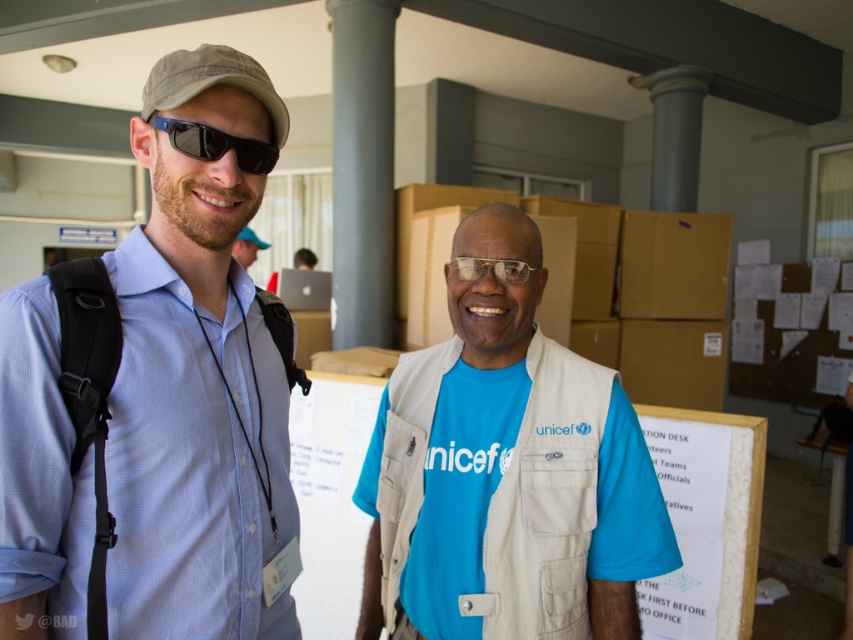
Which is more to the right, gray concrete pillar at center or matte black backpack at left?

From the viewer's perspective, gray concrete pillar at center appears more on the right side.

Describe the element at coordinates (363, 170) in the screenshot. I see `gray concrete pillar at center` at that location.

Between point (376, 227) and point (236, 248), which one is positioned behind?

Point (236, 248)

The height and width of the screenshot is (640, 853). I want to click on gray concrete pillar at center, so click(x=363, y=170).

Does point (68, 518) lie in front of point (184, 145)?

Yes, point (68, 518) is closer to viewer.

Is point (263, 554) less distant than point (207, 154)?

That is False.

Where is `light blue shirt at center`? The height and width of the screenshot is (640, 853). light blue shirt at center is located at coordinates (196, 378).

Is light blue shirt at center closer to camera compared to transparent plastic glasses at center?

Yes, light blue shirt at center is in front of transparent plastic glasses at center.

Who is lower down, light blue shirt at center or transparent plastic glasses at center?

light blue shirt at center is lower down.

This screenshot has width=853, height=640. Identify the location of light blue shirt at center. (196, 378).

What are the coordinates of `light blue shirt at center` in the screenshot? It's located at (196, 378).